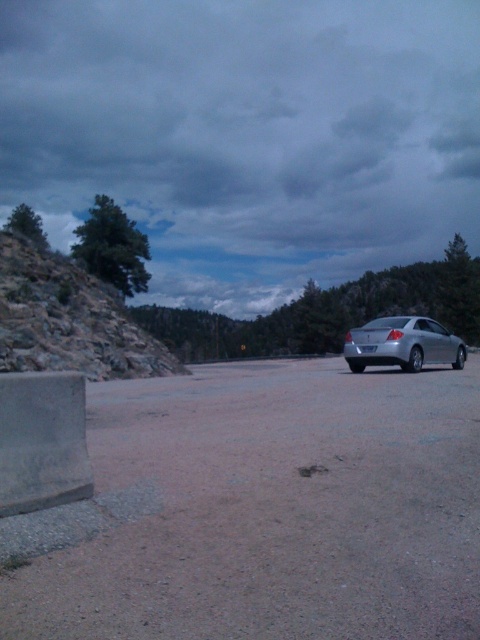
Does brown gravel dirt track at center appear on the right side of silver metallic sedan at right?

No, brown gravel dirt track at center is not to the right of silver metallic sedan at right.

Measure the distance between brown gravel dirt track at center and camera.

brown gravel dirt track at center and camera are 3.14 meters apart.

Locate an element on the screen. brown gravel dirt track at center is located at coordinates (272, 509).